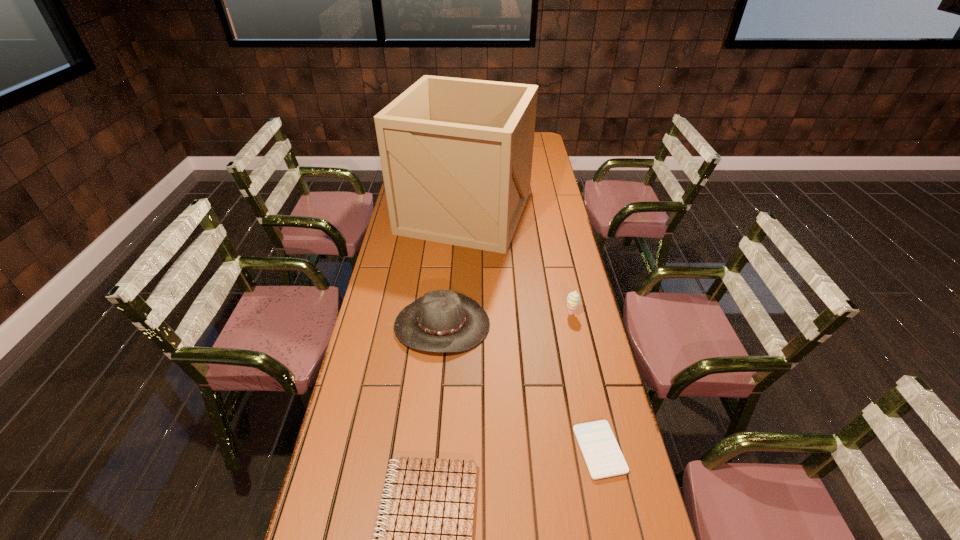
Find the location of a particular element. object that ranks as the fourth closest to the sherbert is located at coordinates (425, 539).

Choose which object is the third nearest neighbor to the box. Please provide its 2D coordinates. Your answer should be formatted as a tuple, i.e. [(x, y)], where the tuple contains the x and y coordinates of a point satisfying the conditions above.

[(601, 452)]

Identify the location of vacant position in the image that satisfies the following two spatial constraints: 1. on the back side of the shortest object; 2. on the left side of the sherbert. (570, 314).